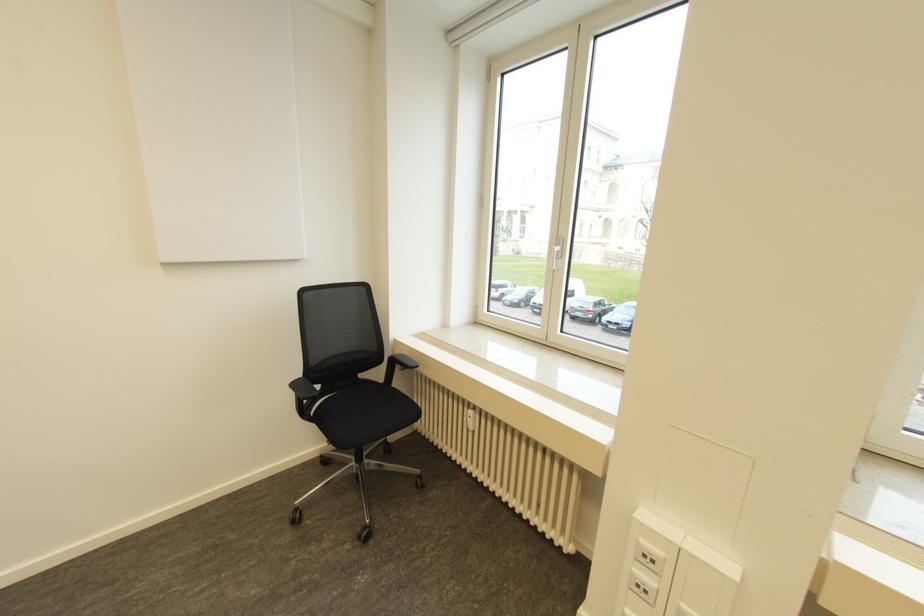
Image resolution: width=924 pixels, height=616 pixels. What do you see at coordinates (362, 408) in the screenshot?
I see `the chair sitting surface` at bounding box center [362, 408].